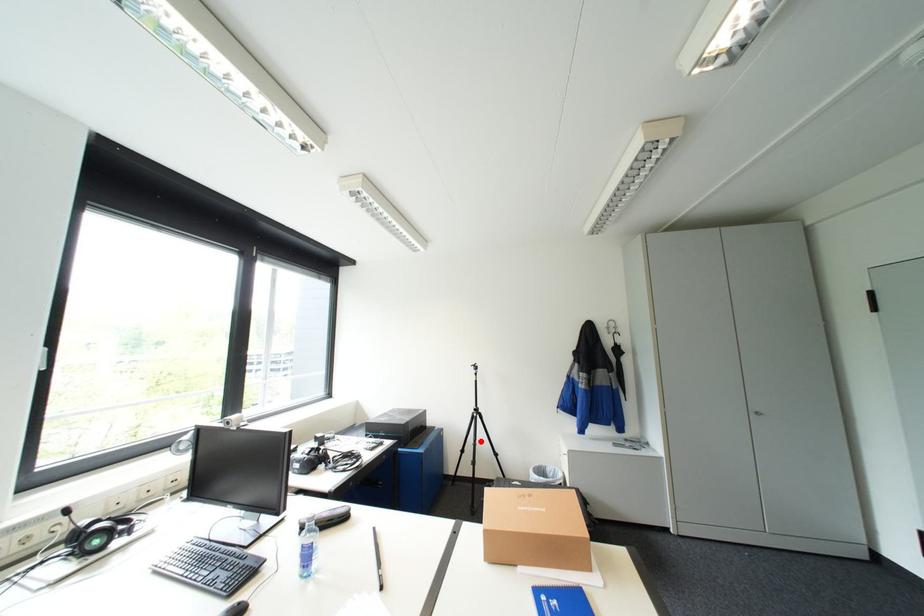
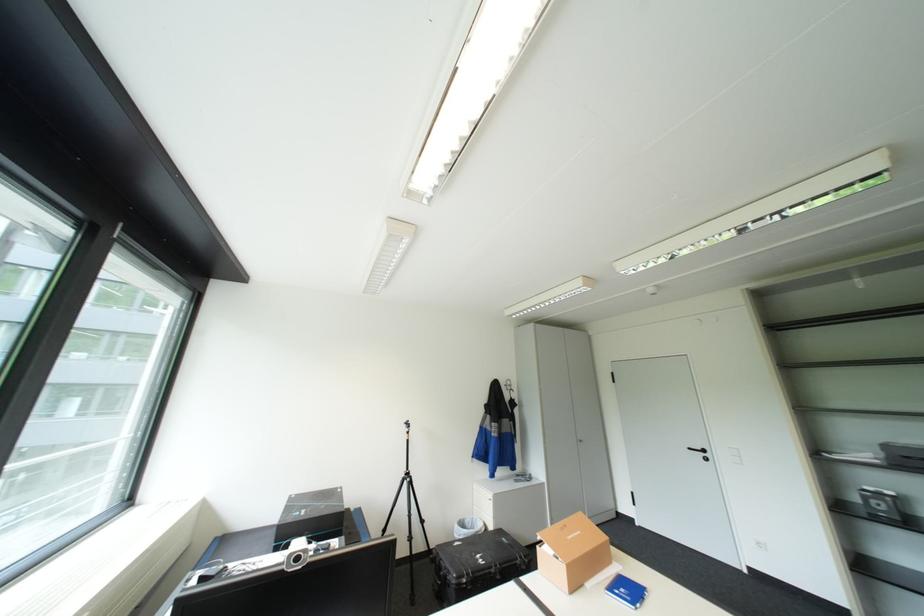
Question: I am providing you with two images of the same scene from different viewpoints. A red point is marked on the first image. Is the red point's position out of view in image 2?

Choices:
 (A) Yes
 (B) No

Answer: (B)